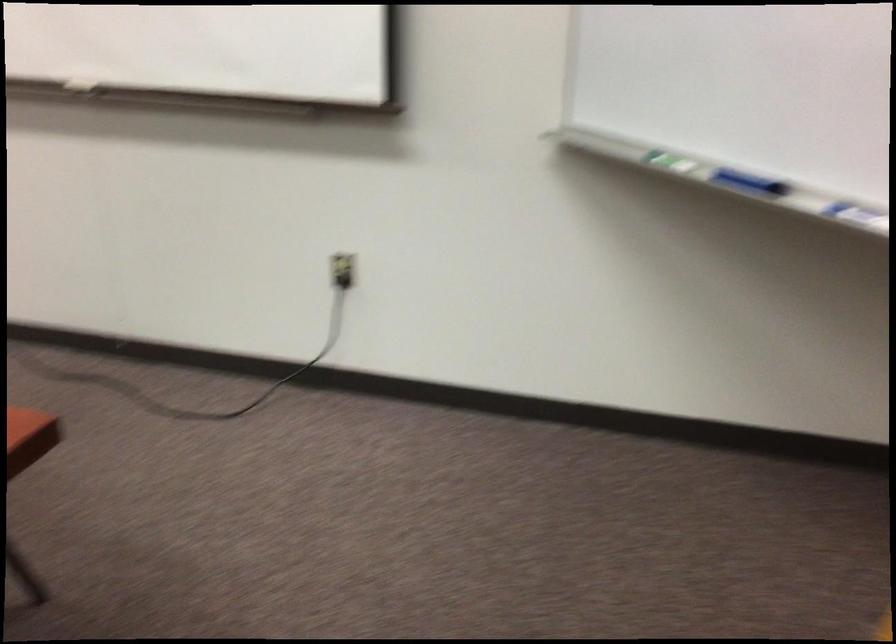
What are the coordinates of `green whiteboard marker` in the screenshot? It's located at (675, 162).